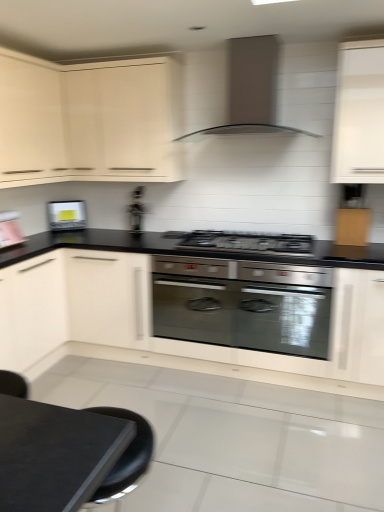
Question: In terms of width, does matte white cabinet at upper left, which appears as the 3th cabinetry when viewed from the right, look wider or thinner when compared to white matte cabinet at upper right, positioned as the 1th cabinetry in right-to-left order?

Choices:
 (A) thin
 (B) wide

Answer: (B)

Question: Looking at the image, does matte white cabinet at upper left, which ranks as the second cabinetry in left-to-right order, seem bigger or smaller compared to white matte cabinet at upper right, placed as the 4th cabinetry when sorted from left to right?

Choices:
 (A) small
 (B) big

Answer: (B)

Question: Which object is positioned farthest from the metallic silver toaster at center?

Choices:
 (A) matte black table at lower left
 (B) matte cream cabinet at upper left, which appears as the 3th cabinetry when viewed from the left
 (C) white matte cabinet at upper right, positioned as the 1th cabinetry in right-to-left order
 (D) satin black gas stove at center
 (E) satin metallic range hood at upper center

Answer: (A)

Question: Estimate the real-world distances between objects in this image. Which object is farther from the matte black table at lower left?

Choices:
 (A) satin black gas stove at center
 (B) white matte cabinet at upper right, placed as the 4th cabinetry when sorted from left to right
 (C) satin metallic range hood at upper center
 (D) white matte cabinet at lower left, placed as the 4th cabinetry when sorted from right to left
 (E) matte silver toaster at left

Answer: (E)